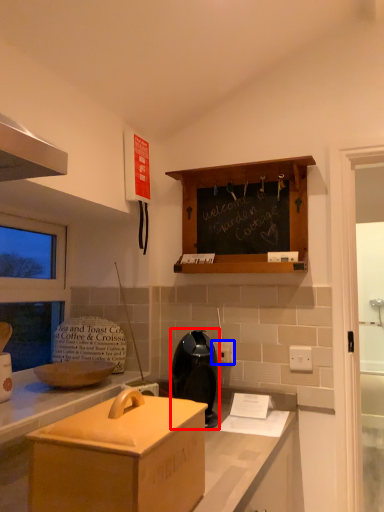
Question: Which object appears farthest to the camera in this image, appliance (highlighted by a red box) or electric outlet (highlighted by a blue box)?

Choices:
 (A) appliance
 (B) electric outlet

Answer: (B)